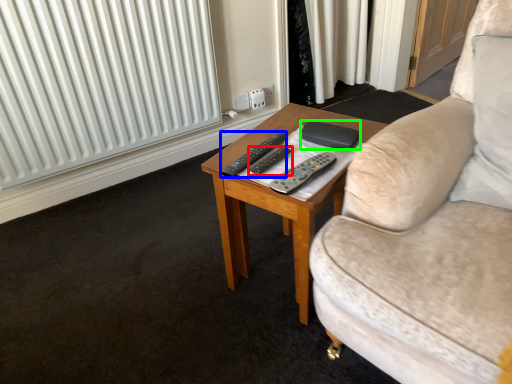
Question: Which object is positioned closest to remote control (highlighted by a red box)? Select from remote control (highlighted by a blue box) and pad (highlighted by a green box).

Choices:
 (A) remote control
 (B) pad

Answer: (A)